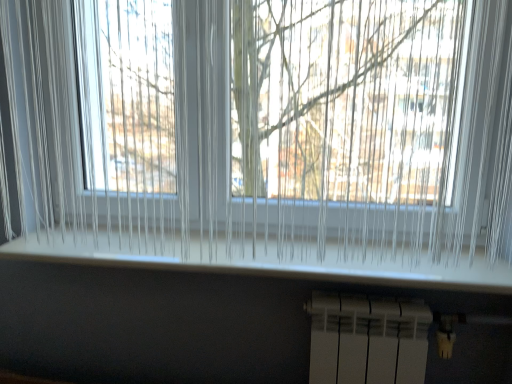
Question: Can you confirm if white plastic window sill at center is bigger than white plastic radiator at bottom?

Choices:
 (A) yes
 (B) no

Answer: (B)

Question: Is white plastic window sill at center taller than white plastic radiator at bottom?

Choices:
 (A) no
 (B) yes

Answer: (A)

Question: From the image's perspective, is white plastic window sill at center on white plastic radiator at bottom?

Choices:
 (A) yes
 (B) no

Answer: (A)

Question: Is white plastic window sill at center shorter than white plastic radiator at bottom?

Choices:
 (A) no
 (B) yes

Answer: (B)

Question: From a real-world perspective, is white plastic window sill at center beneath white plastic radiator at bottom?

Choices:
 (A) no
 (B) yes

Answer: (A)

Question: Is white plastic window sill at center completely or partially outside of white plastic radiator at bottom?

Choices:
 (A) no
 (B) yes

Answer: (B)

Question: Considering the relative positions of white plastic radiator at bottom and white plastic window sill at center in the image provided, is white plastic radiator at bottom to the left of white plastic window sill at center from the viewer's perspective?

Choices:
 (A) no
 (B) yes

Answer: (A)

Question: From a real-world perspective, is white plastic radiator at bottom under white plastic window sill at center?

Choices:
 (A) no
 (B) yes

Answer: (B)

Question: Is white plastic radiator at bottom oriented towards white plastic window sill at center?

Choices:
 (A) yes
 (B) no

Answer: (B)

Question: Is white plastic radiator at bottom beside white plastic window sill at center?

Choices:
 (A) no
 (B) yes

Answer: (A)

Question: From the image's perspective, is white plastic radiator at bottom on top of white plastic window sill at center?

Choices:
 (A) no
 (B) yes

Answer: (A)

Question: Considering the relative sizes of white plastic radiator at bottom and white plastic window sill at center in the image provided, is white plastic radiator at bottom bigger than white plastic window sill at center?

Choices:
 (A) no
 (B) yes

Answer: (B)

Question: Is point (480, 284) positioned closer to the camera than point (379, 337)?

Choices:
 (A) closer
 (B) farther

Answer: (A)